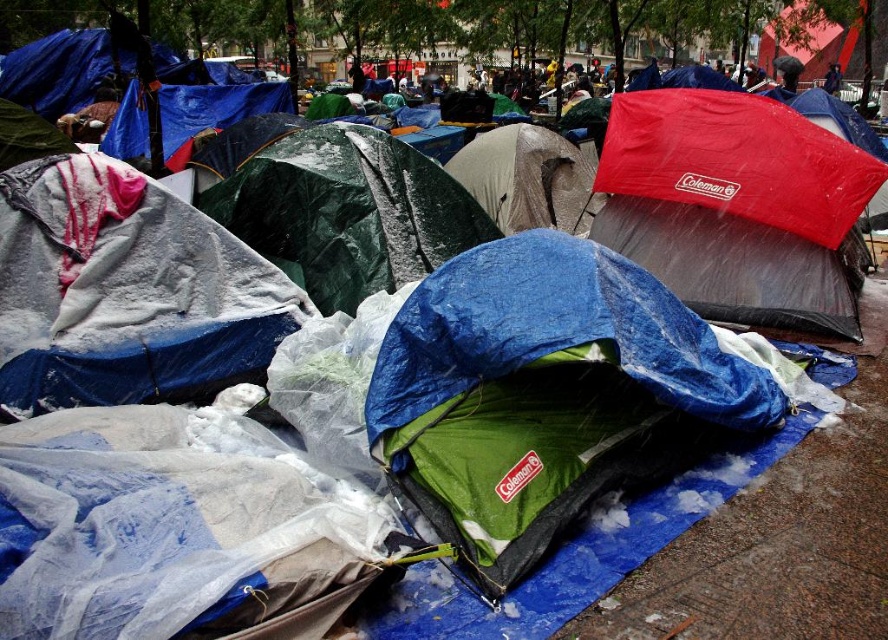
You are planning to set up a tent in this area and need to choose between the blue tarpaulin tent at center and the green tarp at center. Based on their heights, which one would provide more vertical space inside?

The green tarp at center is taller than the blue tarpaulin tent at center, so it would provide more vertical space inside.

You are a delivery person who needs to place a package between the red waterproof tent at upper right and the green tarp at center. The package requires 2 meters of space to be placed safely. Can you fit the package between them?

The red waterproof tent at upper right is 2.55 meters away from the green tarp at center, so yes, the package can be placed safely between them as there is enough space.